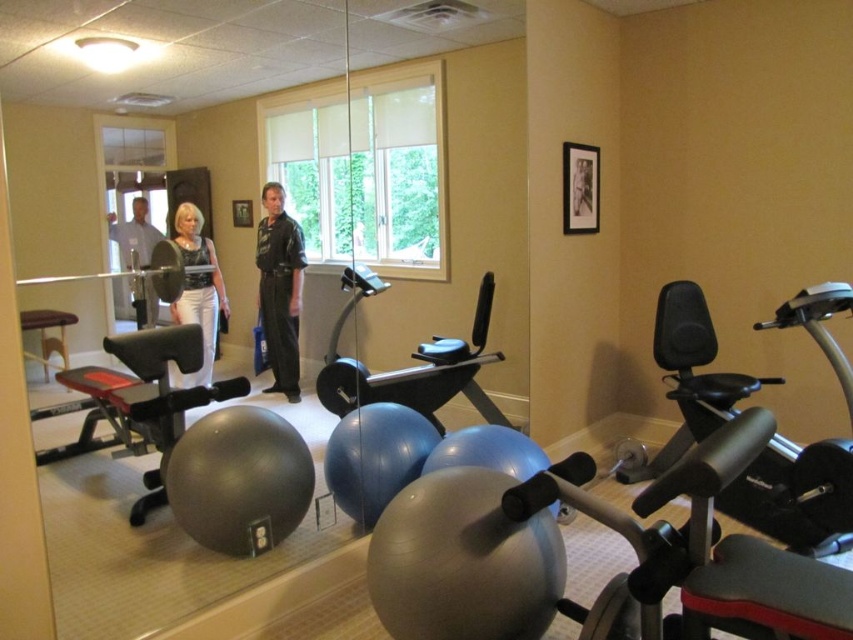
Is black plastic exercise bike at center to the left of light beige shirt at center from the viewer's perspective?

Incorrect, black plastic exercise bike at center is not on the left side of light beige shirt at center.

Is black plastic exercise bike at center wider than light beige shirt at center?

Indeed, black plastic exercise bike at center has a greater width compared to light beige shirt at center.

Between point (770, 518) and point (140, 248), which one is positioned behind?

Point (770, 518)

I want to click on black plastic exercise bike at center, so click(x=796, y=496).

Which is more to the left, matte black exercise ball at center or matte black tank top at center?

From the viewer's perspective, matte black tank top at center appears more on the left side.

Who is shorter, matte black exercise ball at center or matte black tank top at center?

With less height is matte black tank top at center.

Locate an element on the screen. This screenshot has height=640, width=853. matte black exercise ball at center is located at coordinates (413, 365).

The width and height of the screenshot is (853, 640). In order to click on matte black exercise ball at center in this screenshot , I will do [413, 365].

Who is more distant from viewer, (335, 328) or (270, 284)?

Point (335, 328)

In the scene shown: Who is more forward, (x=460, y=348) or (x=285, y=212)?

Positioned in front is point (x=285, y=212).

Identify the location of matte black exercise ball at center. This screenshot has width=853, height=640. (413, 365).